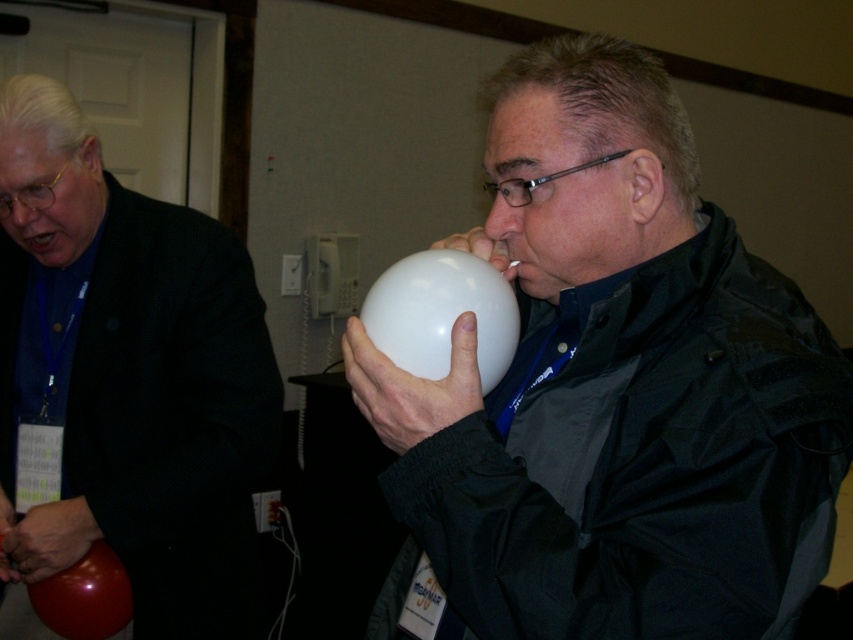
Who is positioned more to the right, white rubber balloon at center or shiny red balloon at lower left?

white rubber balloon at center

What do you see at coordinates (440, 314) in the screenshot? I see `white rubber balloon at center` at bounding box center [440, 314].

Does point (509, 364) come farther from viewer compared to point (48, 609)?

No.

The height and width of the screenshot is (640, 853). Find the location of `white rubber balloon at center`. white rubber balloon at center is located at coordinates (440, 314).

Does point (482, 637) come farther from viewer compared to point (106, 624)?

No, it is not.

Can you confirm if white matte balloon at center is bigger than shiny red balloon at lower left?

Indeed, white matte balloon at center has a larger size compared to shiny red balloon at lower left.

Is point (759, 628) closer to camera compared to point (112, 561)?

Yes, point (759, 628) is closer to viewer.

You are a GUI agent. You are given a task and a screenshot of the screen. Output one action in this format:
    pyautogui.click(x=<x>, y=<y>)
    Task: Click on the white matte balloon at center
    The image size is (853, 640).
    Given the screenshot: What is the action you would take?
    pyautogui.click(x=614, y=392)

The height and width of the screenshot is (640, 853). What do you see at coordinates (614, 392) in the screenshot?
I see `white matte balloon at center` at bounding box center [614, 392].

Who is taller, white matte balloon at center or white rubber balloon at center?

With more height is white matte balloon at center.

Locate an element on the screen. white matte balloon at center is located at coordinates (614, 392).